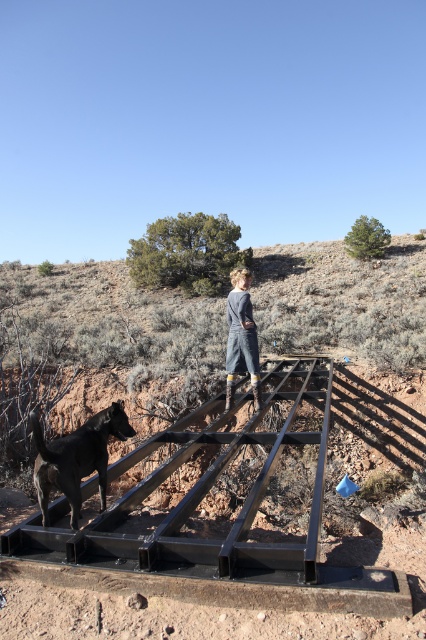
Which is more to the right, shiny black dog at lower left or denim dress at center?

From the viewer's perspective, denim dress at center appears more on the right side.

In the scene shown: Which is above, shiny black dog at lower left or denim dress at center?

denim dress at center

Describe the element at coordinates (77, 458) in the screenshot. I see `shiny black dog at lower left` at that location.

Where is `shiny black dog at lower left`? shiny black dog at lower left is located at coordinates (77, 458).

Does point (25, 342) lie behind point (75, 490)?

Yes, it is.

Does brown dirt hillside at upper center appear under shiny black dog at lower left?

No, brown dirt hillside at upper center is not below shiny black dog at lower left.

This screenshot has width=426, height=640. I want to click on brown dirt hillside at upper center, so click(342, 300).

Can you confirm if black metal rail at center is thinner than shiny black dog at lower left?

Indeed, black metal rail at center has a lesser width compared to shiny black dog at lower left.

Between point (74, 561) and point (100, 454), which one is positioned behind?

The point (100, 454) is more distant.

Where is `black metal rail at center`? This screenshot has height=640, width=426. black metal rail at center is located at coordinates (198, 492).